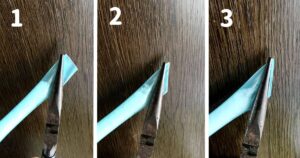
Where is `surface`? surface is located at coordinates (182, 121).